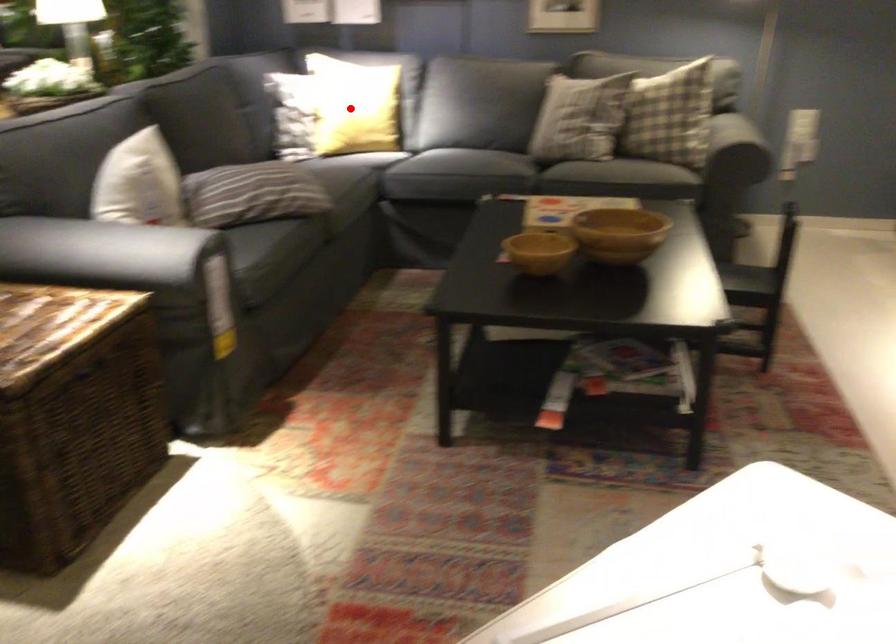
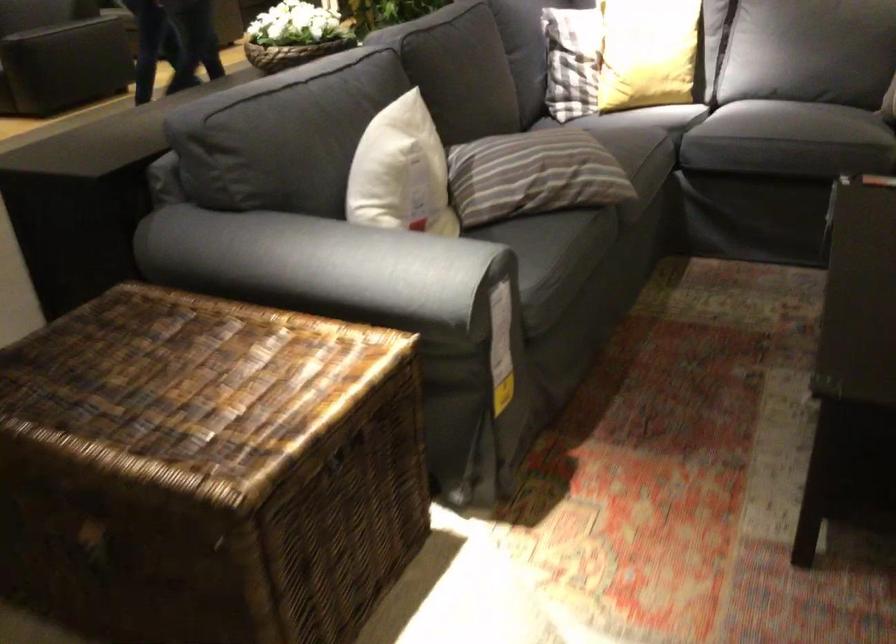
Locate, in the second image, the point that corresponds to the highlighted location in the first image.

(647, 53)